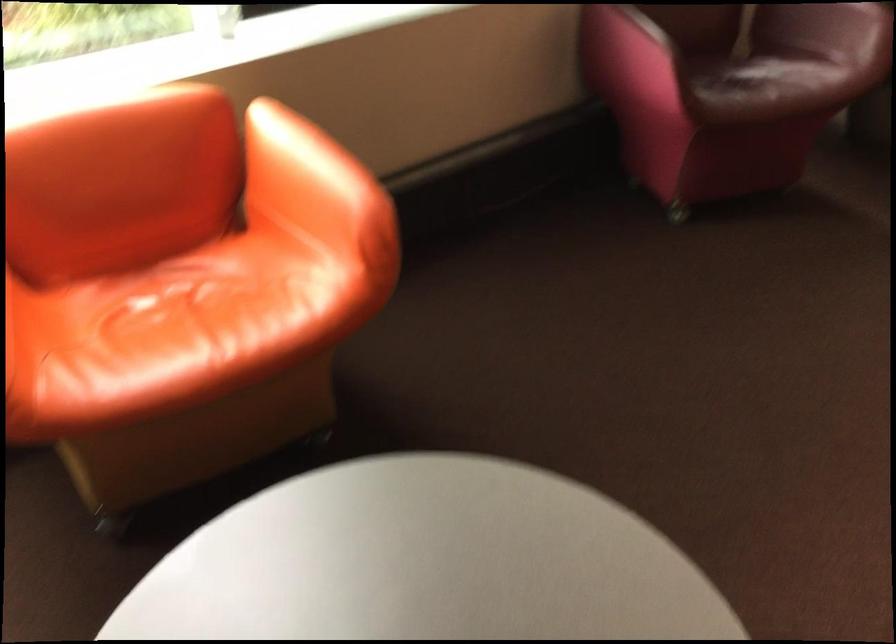
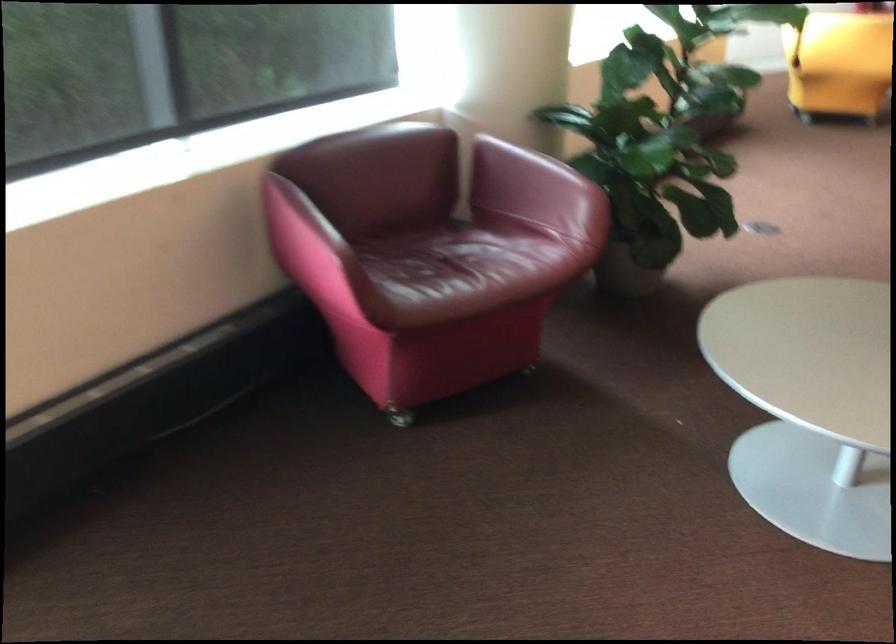
In the scene shown: Which direction would the cameraman need to move to produce the second image?

The cameraman moved toward right, forward.